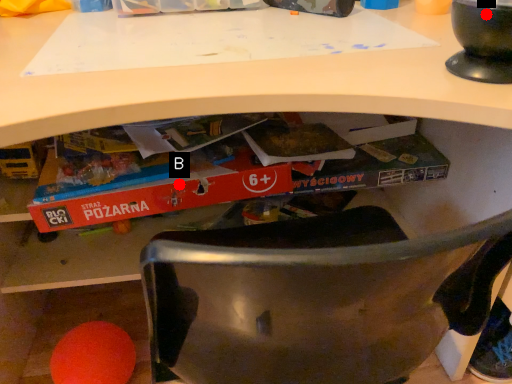
Question: Two points are circled on the image, labeled by A and B beside each circle. Which point is closer to the camera taking this photo?

Choices:
 (A) A is closer
 (B) B is closer

Answer: (A)